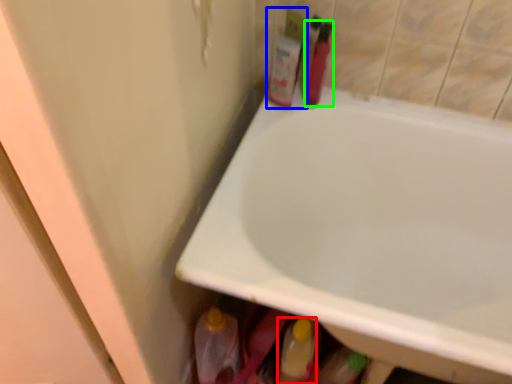
Question: Which is farther away from mouthwash (highlighted by a red box)? toiletry (highlighted by a blue box) or toiletry (highlighted by a green box)?

Choices:
 (A) toiletry
 (B) toiletry

Answer: (B)